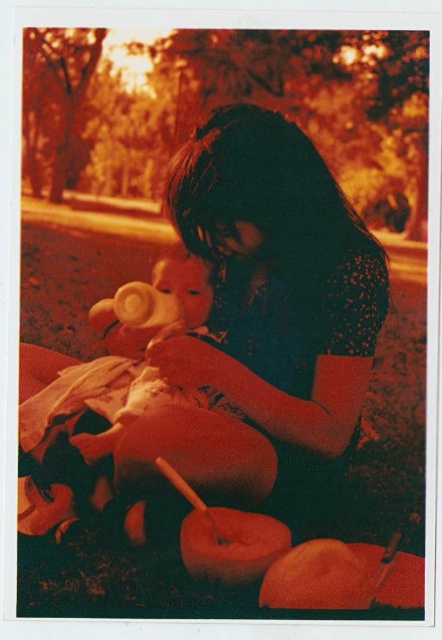
Does matte black dress at center have a greater height compared to smooth beige bottle at left?

Yes.

I want to click on matte black dress at center, so click(x=229, y=339).

The width and height of the screenshot is (442, 640). What do you see at coordinates (229, 339) in the screenshot? I see `matte black dress at center` at bounding box center [229, 339].

The image size is (442, 640). I want to click on matte black dress at center, so click(x=229, y=339).